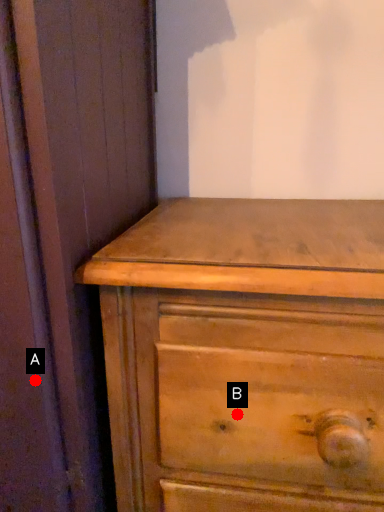
Question: Two points are circled on the image, labeled by A and B beside each circle. Among these points, which one is farthest from the camera?

Choices:
 (A) A is further
 (B) B is further

Answer: (B)